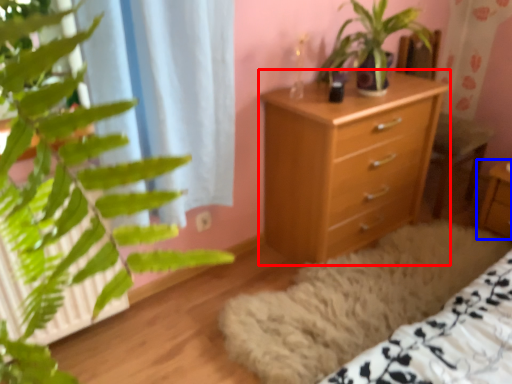
Question: Which object appears farthest to the camera in this image, chest of drawers (highlighted by a red box) or nightstand (highlighted by a blue box)?

Choices:
 (A) chest of drawers
 (B) nightstand

Answer: (B)